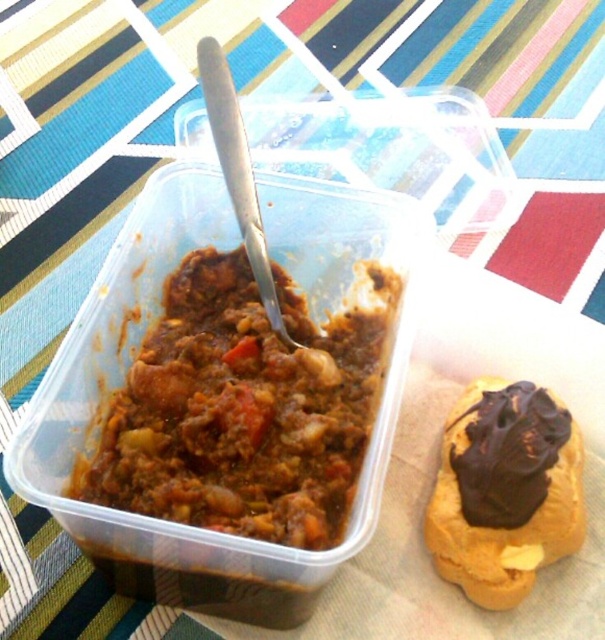
Question: Is brown matte stew at center behind chocolate-frosted pastry at center?

Choices:
 (A) no
 (B) yes

Answer: (A)

Question: Where is brown matte stew at center located in relation to chocolate-frosted pastry at center in the image?

Choices:
 (A) left
 (B) right

Answer: (A)

Question: Which point is farther from the camera taking this photo?

Choices:
 (A) (325, 538)
 (B) (474, 481)

Answer: (B)

Question: Which of the following is the closest to the observer?

Choices:
 (A) brown matte stew at center
 (B) chocolate-frosted pastry at center

Answer: (A)

Question: Does brown matte stew at center lie in front of chocolate-frosted pastry at center?

Choices:
 (A) no
 (B) yes

Answer: (B)